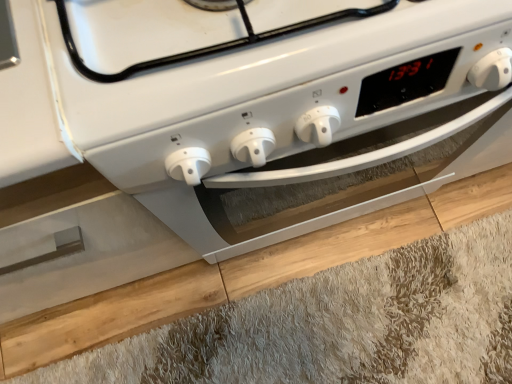
This screenshot has width=512, height=384. What do you see at coordinates (242, 274) in the screenshot?
I see `light brown wood at lower center` at bounding box center [242, 274].

In order to click on light brown wood at lower center in this screenshot , I will do `click(242, 274)`.

Identify the location of white glossy oven at center. (246, 99).

The width and height of the screenshot is (512, 384). What do you see at coordinates (246, 99) in the screenshot?
I see `white glossy oven at center` at bounding box center [246, 99].

The image size is (512, 384). Find the location of `light brown wood at lower center`. light brown wood at lower center is located at coordinates (242, 274).

Visually, is white glossy oven at center positioned to the left or to the right of light brown wood at lower center?

Clearly, white glossy oven at center is on the left of light brown wood at lower center in the image.

Based on the photo, does white glossy oven at center come behind light brown wood at lower center?

No, white glossy oven at center is closer to the camera.

Does point (343, 75) appear closer or farther from the camera than point (321, 229)?

Point (343, 75) is positioned closer to the camera compared to point (321, 229).

From the image's perspective, is white glossy oven at center located above light brown wood at lower center?

Yes, from the image's perspective, white glossy oven at center is above light brown wood at lower center.

From a real-world perspective, between white glossy oven at center and light brown wood at lower center, who is vertically lower?

From a 3D spatial view, light brown wood at lower center is below.

Based on the photo, is white glossy oven at center thinner than light brown wood at lower center?

Yes.

Does white glossy oven at center have a greater height compared to light brown wood at lower center?

Indeed, white glossy oven at center has a greater height compared to light brown wood at lower center.

Who is smaller, white glossy oven at center or light brown wood at lower center?

Smaller between the two is white glossy oven at center.

Choose the correct answer: Is white glossy oven at center inside light brown wood at lower center or outside it?

white glossy oven at center is spatially situated outside light brown wood at lower center.

Is white glossy oven at center far from light brown wood at lower center?

Actually, white glossy oven at center and light brown wood at lower center are a little close together.

Is white glossy oven at center facing towards light brown wood at lower center?

No, white glossy oven at center is not oriented towards light brown wood at lower center.

Can you tell me how much white glossy oven at center and light brown wood at lower center differ in facing direction?

There is a 179-degree angle between the facing directions of white glossy oven at center and light brown wood at lower center.

Identify the location of home appliance that appears above the light brown wood at lower center (from the image's perspective). Image resolution: width=512 pixels, height=384 pixels. (246, 99).

Considering the positions of objects light brown wood at lower center and white glossy oven at center in the image provided, who is more to the right, light brown wood at lower center or white glossy oven at center?

light brown wood at lower center is more to the right.

Considering the positions of objects light brown wood at lower center and white glossy oven at center in the image provided, who is behind, light brown wood at lower center or white glossy oven at center?

Positioned behind is light brown wood at lower center.

Is point (150, 299) positioned behind point (439, 1)?

Yes, point (150, 299) is behind point (439, 1).

From the image's perspective, between light brown wood at lower center and white glossy oven at center, who is located below?

light brown wood at lower center is shown below in the image.

From a real-world perspective, is light brown wood at lower center physically below white glossy oven at center?

Yes, from a real-world perspective, light brown wood at lower center is below white glossy oven at center.

Does light brown wood at lower center have a lesser width compared to white glossy oven at center?

No, light brown wood at lower center is not thinner than white glossy oven at center.

Between light brown wood at lower center and white glossy oven at center, which one has less height?

light brown wood at lower center.

Is light brown wood at lower center smaller than white glossy oven at center?

No, light brown wood at lower center is not smaller than white glossy oven at center.

Consider the image. Would you say light brown wood at lower center is inside or outside white glossy oven at center?

light brown wood at lower center is outside white glossy oven at center.

Would you consider light brown wood at lower center to be distant from white glossy oven at center?

They are positioned close to each other.

Is light brown wood at lower center aimed at white glossy oven at center?

No, light brown wood at lower center is not aimed at white glossy oven at center.

How different are the orientations of light brown wood at lower center and white glossy oven at center in degrees?

light brown wood at lower center and white glossy oven at center are facing 179 degrees away from each other.

The width and height of the screenshot is (512, 384). What are the coordinates of `home appliance lying in front of the light brown wood at lower center` in the screenshot? It's located at (246, 99).

You are a GUI agent. You are given a task and a screenshot of the screen. Output one action in this format:
    pyautogui.click(x=<x>, y=<y>)
    Task: Click on the home appliance above the light brown wood at lower center (from a real-world perspective)
    
    Given the screenshot: What is the action you would take?
    pyautogui.click(x=246, y=99)

Where is `home appliance located in front of the light brown wood at lower center`? Image resolution: width=512 pixels, height=384 pixels. home appliance located in front of the light brown wood at lower center is located at coordinates (246, 99).